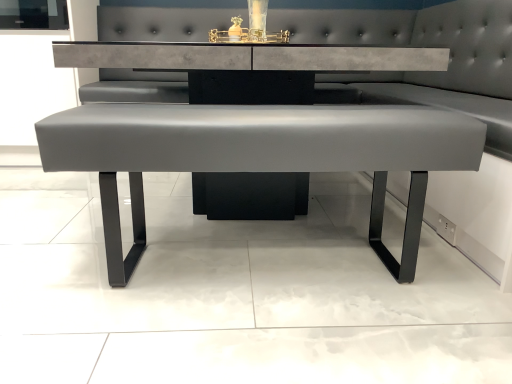
Question: From the image's perspective, is satin gray bench at center, the second table positioned from the back, on satin gray leather bench at center, positioned as the 2th table in front-to-back order?

Choices:
 (A) yes
 (B) no

Answer: (B)

Question: Is the position of satin gray bench at center, which is the 1th table from front to back, more distant than that of satin gray leather bench at center, positioned as the 2th table in front-to-back order?

Choices:
 (A) no
 (B) yes

Answer: (A)

Question: Does satin gray bench at center, which is the 1th table from front to back, have a larger size compared to satin gray leather bench at center, which ranks as the first table in back-to-front order?

Choices:
 (A) yes
 (B) no

Answer: (B)

Question: Can you confirm if satin gray bench at center, which is the 1th table from front to back, is taller than satin gray leather bench at center, positioned as the 2th table in front-to-back order?

Choices:
 (A) yes
 (B) no

Answer: (B)

Question: Is satin gray bench at center, the second table positioned from the back, positioned beyond the bounds of satin gray leather bench at center, positioned as the 2th table in front-to-back order?

Choices:
 (A) yes
 (B) no

Answer: (B)

Question: Is satin gray bench at center, the second table positioned from the back, thinner than satin gray leather bench at center, positioned as the 2th table in front-to-back order?

Choices:
 (A) yes
 (B) no

Answer: (A)

Question: Is satin gray leather bench at center, which ranks as the first table in back-to-front order, facing towards satin gray bench at center, the second table positioned from the back?

Choices:
 (A) no
 (B) yes

Answer: (B)

Question: From a real-world perspective, is satin gray leather bench at center, which ranks as the first table in back-to-front order, positioned over satin gray bench at center, which is the 1th table from front to back, based on gravity?

Choices:
 (A) no
 (B) yes

Answer: (B)

Question: Considering the relative positions of satin gray leather bench at center, positioned as the 2th table in front-to-back order, and satin gray bench at center, which is the 1th table from front to back, in the image provided, is satin gray leather bench at center, positioned as the 2th table in front-to-back order, to the right of satin gray bench at center, which is the 1th table from front to back, from the viewer's perspective?

Choices:
 (A) no
 (B) yes

Answer: (A)

Question: Is satin gray leather bench at center, positioned as the 2th table in front-to-back order, far from satin gray bench at center, the second table positioned from the back?

Choices:
 (A) yes
 (B) no

Answer: (B)

Question: Is satin gray leather bench at center, which ranks as the first table in back-to-front order, looking in the opposite direction of satin gray bench at center, the second table positioned from the back?

Choices:
 (A) yes
 (B) no

Answer: (B)

Question: From the image's perspective, is satin gray leather bench at center, which ranks as the first table in back-to-front order, below satin gray bench at center, which is the 1th table from front to back?

Choices:
 (A) no
 (B) yes

Answer: (A)

Question: From a real-world perspective, is satin gray bench at center, the second table positioned from the back, above or below satin gray leather bench at center, positioned as the 2th table in front-to-back order?

Choices:
 (A) above
 (B) below

Answer: (B)